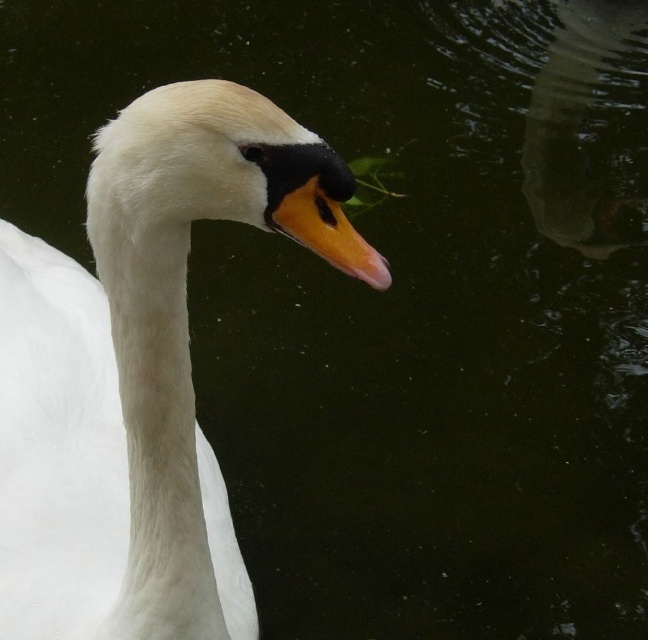
You are a wildlife photographer trying to capture a closeup of the white feathered swan at center and the orange glossy beak at center. Based on their positions, which object should you focus on first if you want to ensure both are in sharp focus?

The white feathered swan at center is to the left of the orange glossy beak at center. Since they are positioned side by side, focusing on the swan first will help ensure both are in focus as you adjust the camera settings.

You are a wildlife photographer trying to capture a close shot of the white feathered swan at center and the orange glossy beak at center. Based on their sizes, which one will appear bigger in your photo?

The white feathered swan at center will appear bigger in the photo because it has a larger size compared to the orange glossy beak at center.

Based on the scene, can you determine which object is taller between the white feathered swan at center and the orange glossy beak at center?

The white feathered swan at center is taller than the orange glossy beak at center according to the description.